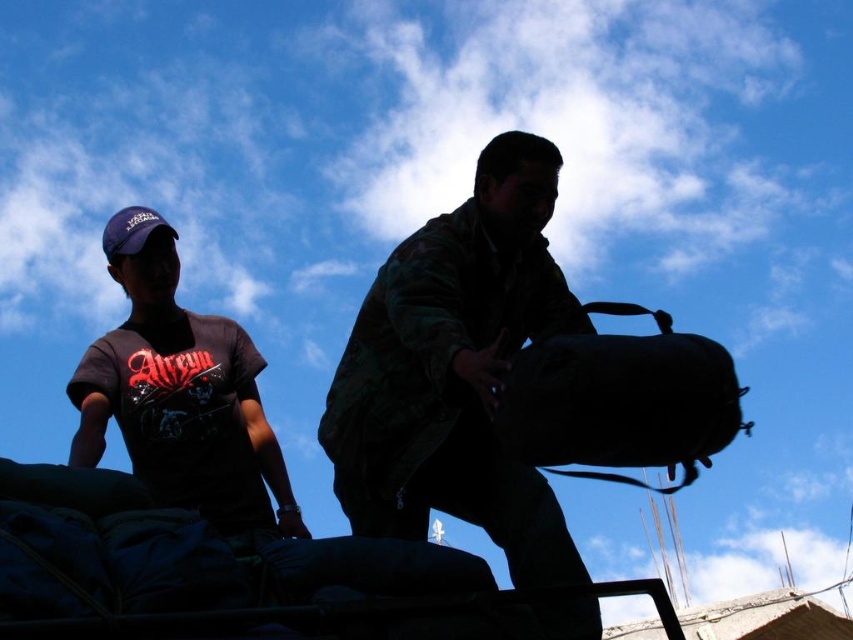
Is camo fabric backpack at center taller than dark camouflage jacket at upper center?

Correct, camo fabric backpack at center is much taller as dark camouflage jacket at upper center.

Which is in front, point (457, 259) or point (137, 460)?

Point (457, 259) is more forward.

You are a GUI agent. You are given a task and a screenshot of the screen. Output one action in this format:
    pyautogui.click(x=<x>, y=<y>)
    Task: Click on the camo fabric backpack at center
    
    Given the screenshot: What is the action you would take?
    pyautogui.click(x=456, y=371)

Who is shorter, camo fabric backpack at center or black fabric bag at right?

black fabric bag at right

This screenshot has width=853, height=640. What do you see at coordinates (456, 371) in the screenshot? I see `camo fabric backpack at center` at bounding box center [456, 371].

Image resolution: width=853 pixels, height=640 pixels. What are the coordinates of `camo fabric backpack at center` in the screenshot? It's located at tap(456, 371).

Is dark camouflage jacket at upper center to the left of black fabric bag at right from the viewer's perspective?

Indeed, dark camouflage jacket at upper center is positioned on the left side of black fabric bag at right.

Between point (228, 452) and point (670, 380), which one is positioned in front?

Point (670, 380) is more forward.

The image size is (853, 640). What are the coordinates of `dark camouflage jacket at upper center` in the screenshot? It's located at (221, 432).